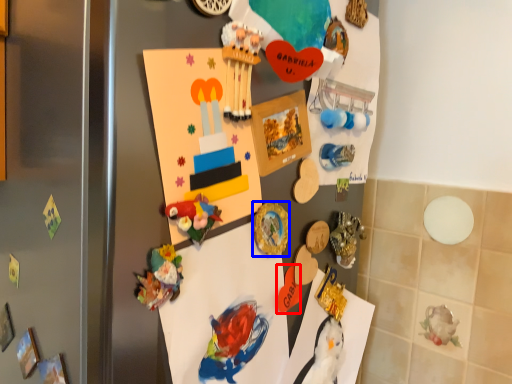
Question: Which point is closer to the camera, toy (highlighted by a red box) or button (highlighted by a blue box)?

Choices:
 (A) toy
 (B) button

Answer: (B)